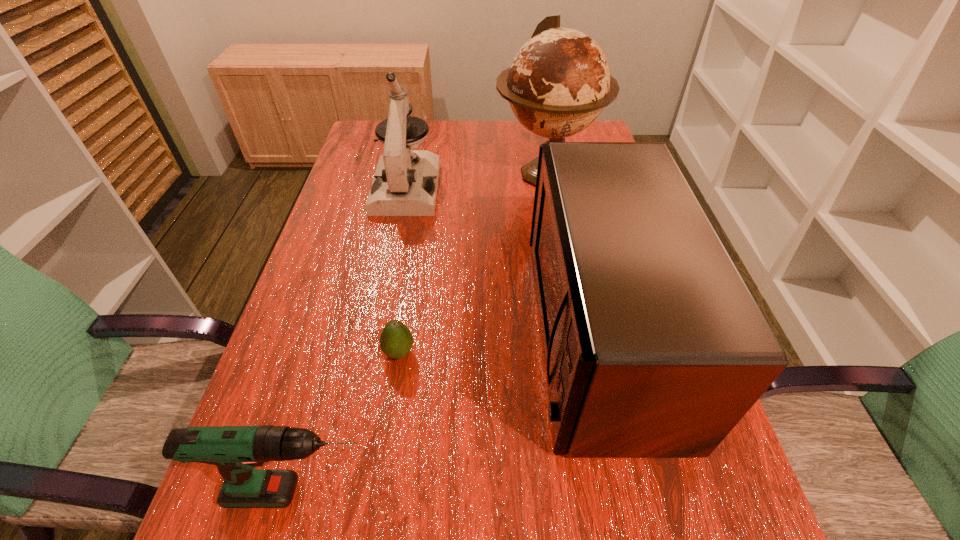
Point out which object is positioned as the nearest to the nearest object. Please provide its 2D coordinates. Your answer should be formatted as a tuple, i.e. [(x, y)], where the tuple contains the x and y coordinates of a point satisfying the conditions above.

[(396, 340)]

I want to click on free spot that satisfies the following two spatial constraints: 1. at the eyepiece of the microscope; 2. on the handle side of the drill, so click(x=346, y=492).

This screenshot has width=960, height=540. What are the coordinates of `vacant region that satisfies the following two spatial constraints: 1. on the front side of the avocado; 2. on the handle side of the fourth tallest object` in the screenshot? It's located at (377, 492).

Where is `free spot that satisfies the following two spatial constraints: 1. at the eyepiece of the microscope; 2. on the handle side of the nearest object`? This screenshot has height=540, width=960. free spot that satisfies the following two spatial constraints: 1. at the eyepiece of the microscope; 2. on the handle side of the nearest object is located at coordinates (346, 492).